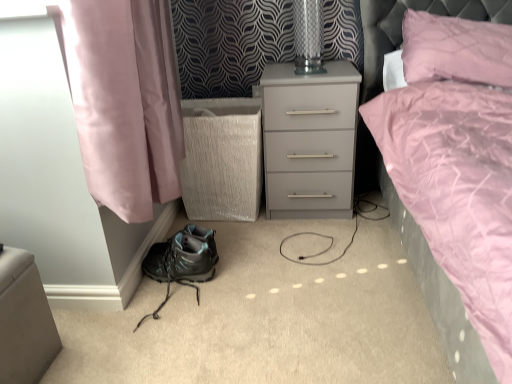
I want to click on blank area beneath matte black hiking boot at lower left (from a real-world perspective), so click(x=167, y=302).